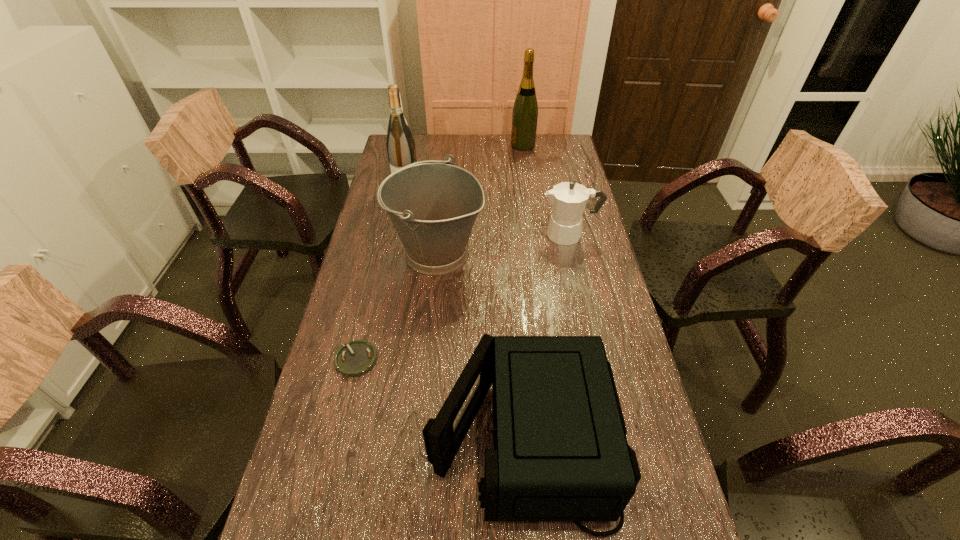
What are the coordinates of `blank space that satisfies the following two spatial constraints: 1. on the front side of the fifth nearest object; 2. on the left side of the bucket` in the screenshot? It's located at (393, 253).